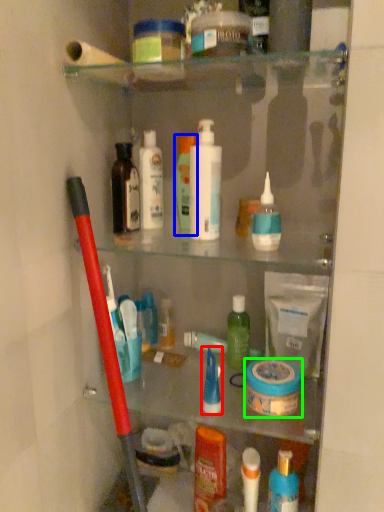
Question: Which object is the closest to the toiletry (highlighted by a red box)? Choose among these: mouthwash (highlighted by a blue box) or mouthwash (highlighted by a green box).

Choices:
 (A) mouthwash
 (B) mouthwash

Answer: (B)